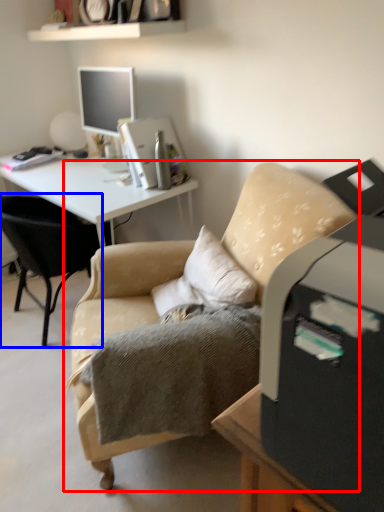
Question: Which point is closer to the camera, chair (highlighted by a red box) or chair (highlighted by a blue box)?

Choices:
 (A) chair
 (B) chair

Answer: (A)